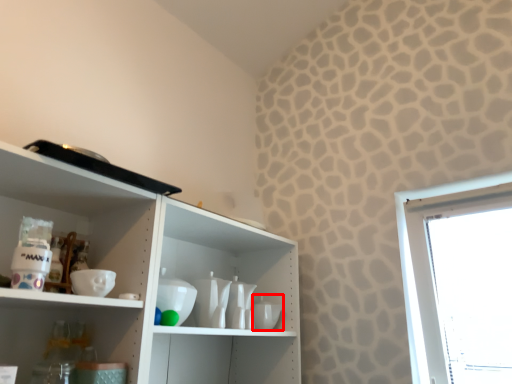
Question: From the image's perspective, what is the correct spatial relationship of tableware (annotated by the red box) in relation to tableware?

Choices:
 (A) below
 (B) above

Answer: (A)